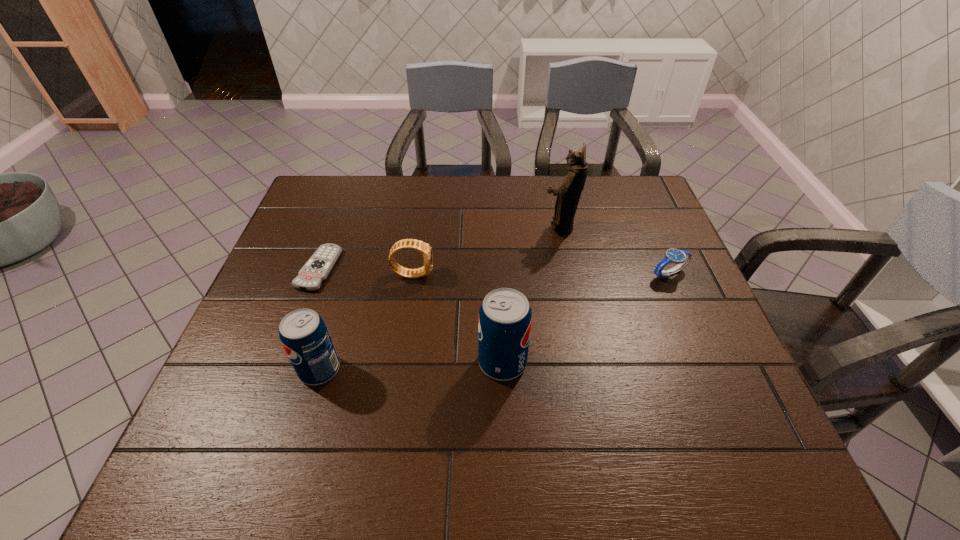
This screenshot has width=960, height=540. Find the location of `the rightmost object`. the rightmost object is located at coordinates (681, 257).

At what (x,y) coordinates should I click in order to perform the action: click on free space located 0.060m on the left of the fourth shortest object. Please return your answer as a coordinate pair (x, y). The height and width of the screenshot is (540, 960). Looking at the image, I should click on coord(273,370).

In order to click on vacant point located 0.110m on the back of the second tallest object in this screenshot , I will do pos(500,307).

This screenshot has width=960, height=540. Identify the location of free location located on the front-facing side of the tallest object. (409, 228).

This screenshot has width=960, height=540. I want to click on vacant space located on the front-facing side of the tallest object, so click(489, 228).

This screenshot has width=960, height=540. Identify the location of vacant region located on the front-facing side of the tallest object. (432, 228).

Locate an element on the screen. vacant area located on the left of the remote control is located at coordinates (278, 269).

Identify the location of free space located 0.130m on the face of the fourth tallest object. (481, 274).

Locate an element on the screen. The width and height of the screenshot is (960, 540). vacant point located on the front of the right watch is located at coordinates (732, 421).

I want to click on object that is at the far edge, so click(x=568, y=194).